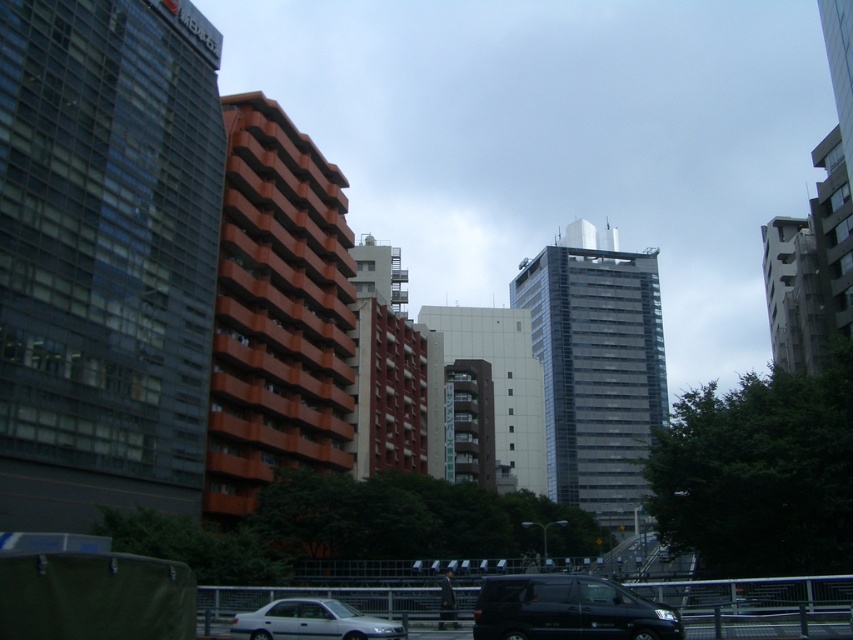
Question: Does black matte van at lower center have a smaller size compared to silver metallic car at center?

Choices:
 (A) no
 (B) yes

Answer: (A)

Question: Which point is closer to the camera?

Choices:
 (A) (640, 634)
 (B) (326, 616)

Answer: (A)

Question: Does black matte van at lower center appear on the right side of silver metallic car at center?

Choices:
 (A) yes
 (B) no

Answer: (A)

Question: Among these points, which one is nearest to the camera?

Choices:
 (A) (503, 627)
 (B) (346, 609)

Answer: (A)

Question: Does black matte van at lower center have a greater width compared to silver metallic car at center?

Choices:
 (A) yes
 (B) no

Answer: (A)